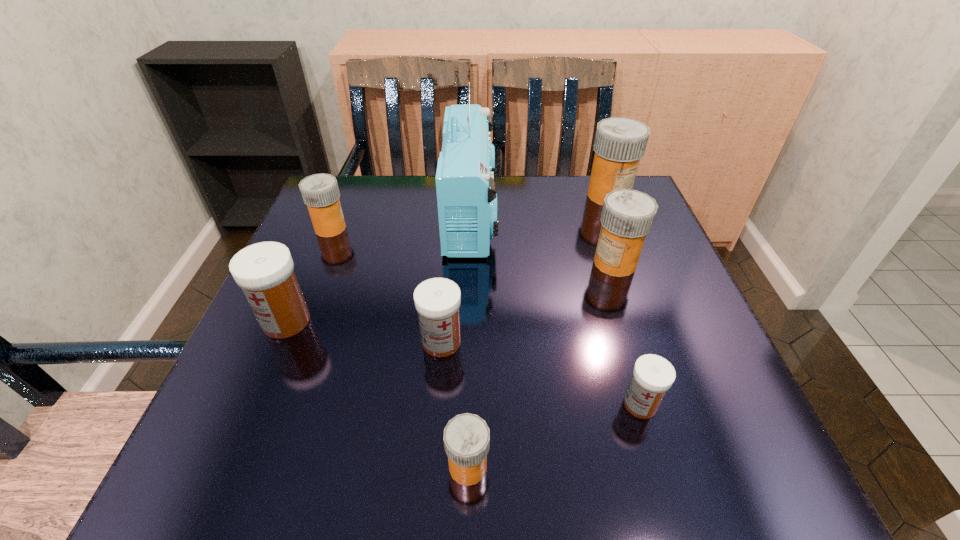
Find the location of `blank space located 0.190m on the label side of the leftmost orange medicine`. blank space located 0.190m on the label side of the leftmost orange medicine is located at coordinates (429, 228).

At what (x,y) coordinates should I click in order to perform the action: click on free spot located 0.120m on the back of the second biggest white medicine. Please return your answer as a coordinate pair (x, y). The height and width of the screenshot is (540, 960). Looking at the image, I should click on (446, 280).

The width and height of the screenshot is (960, 540). Find the location of `vacant space located 0.280m on the back of the seventh farthest object`. vacant space located 0.280m on the back of the seventh farthest object is located at coordinates (601, 272).

The width and height of the screenshot is (960, 540). I want to click on vacant region located 0.090m on the label side of the third orange medicine from right to left, so click(553, 467).

Locate an element on the screen. This screenshot has height=540, width=960. radio receiver positioned at the far edge is located at coordinates (465, 178).

You are a GUI agent. You are given a task and a screenshot of the screen. Output one action in this format:
    pyautogui.click(x=<x>, y=<y>)
    Task: Click on the object located at the near edge
    This screenshot has height=540, width=960.
    Given the screenshot: What is the action you would take?
    (x=466, y=438)

The height and width of the screenshot is (540, 960). Identify the location of object positioned at the far left corner. [x=320, y=192].

Where is `object at the far right corner`? This screenshot has height=540, width=960. object at the far right corner is located at coordinates (620, 143).

In the image, there is a desktop. At what (x,y) coordinates should I click in order to perform the action: click on free space at the far edge. Please return your answer as a coordinate pair (x, y). Looking at the image, I should click on (432, 202).

Locate an element on the screen. vacant space at the left edge of the desktop is located at coordinates (240, 376).